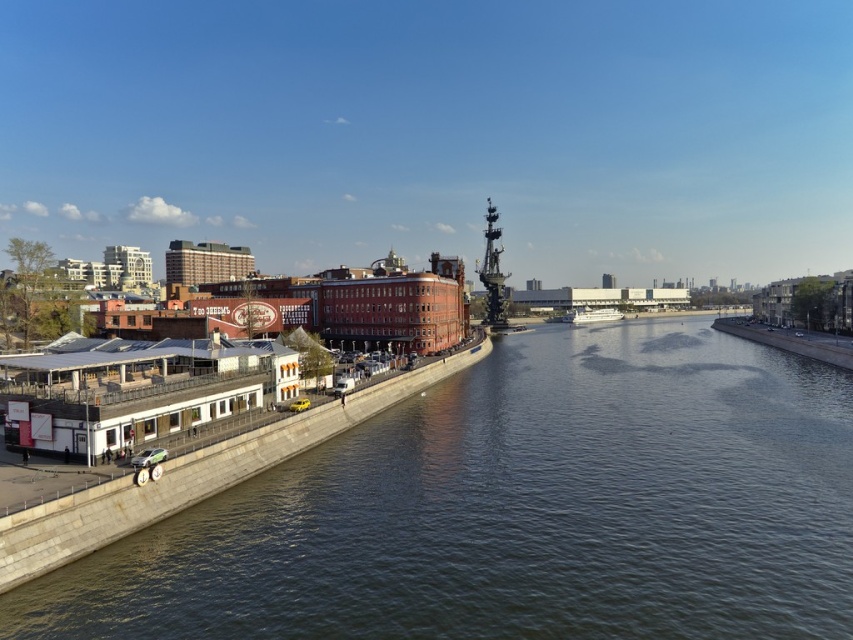
Question: In this image, where is dark green water at center located relative to white glossy boat at center-right?

Choices:
 (A) right
 (B) left

Answer: (B)

Question: Can you confirm if dark green water at center is thinner than white glossy boat at center-right?

Choices:
 (A) no
 (B) yes

Answer: (A)

Question: Which point is closer to the camera taking this photo?

Choices:
 (A) (177, 637)
 (B) (573, 321)

Answer: (A)

Question: Is dark green water at center above white glossy boat at center-right?

Choices:
 (A) no
 (B) yes

Answer: (A)

Question: Which object appears farthest from the camera in this image?

Choices:
 (A) white glossy boat at center-right
 (B) dark green water at center

Answer: (A)